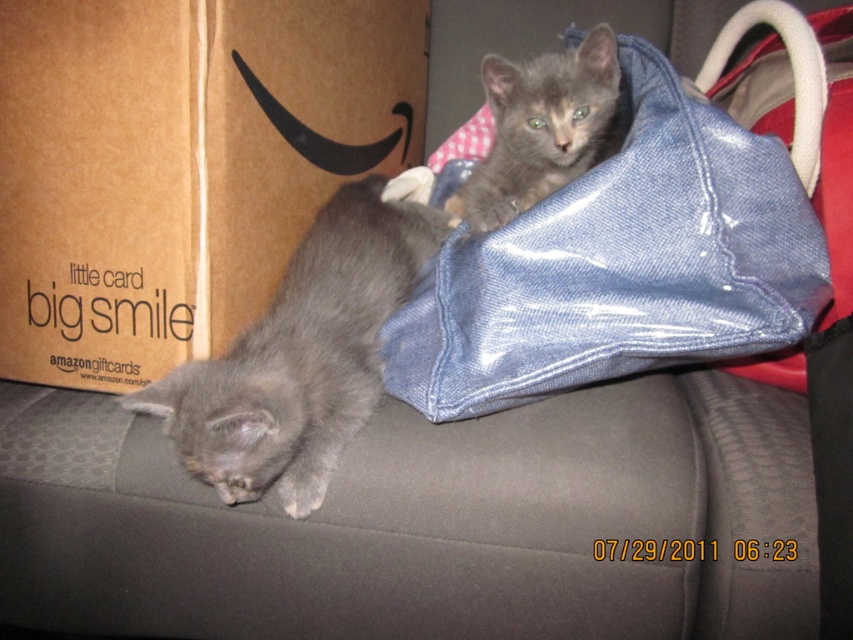
Who is shorter, soft gray kitten at left or gray fur cat at lower left?

With less height is soft gray kitten at left.

Can you confirm if soft gray kitten at left is positioned to the right of gray fur cat at lower left?

Correct, you'll find soft gray kitten at left to the right of gray fur cat at lower left.

Consider the image. Who is more distant from viewer, (386, 588) or (318, 292)?

The point (318, 292) is more distant.

Where is `soft gray kitten at left`? This screenshot has width=853, height=640. soft gray kitten at left is located at coordinates (422, 522).

From the picture: Is denim bag at upper right positioned behind gray furry kitten at upper right?

No.

Which is behind, point (535, 356) or point (494, 74)?

The point (494, 74) is behind.

You are a GUI agent. You are given a task and a screenshot of the screen. Output one action in this format:
    pyautogui.click(x=<x>, y=<y>)
    Task: Click on the denim bag at upper right
    This screenshot has height=640, width=853.
    Given the screenshot: What is the action you would take?
    pyautogui.click(x=619, y=266)

Does soft gray kitten at left come in front of denim bag at upper right?

Yes, soft gray kitten at left is in front of denim bag at upper right.

You are a GUI agent. You are given a task and a screenshot of the screen. Output one action in this format:
    pyautogui.click(x=<x>, y=<y>)
    Task: Click on the soft gray kitten at left
    This screenshot has width=853, height=640.
    Given the screenshot: What is the action you would take?
    pyautogui.click(x=422, y=522)

Is point (540, 528) positioned in front of point (701, 172)?

That is True.

I want to click on soft gray kitten at left, so point(422,522).